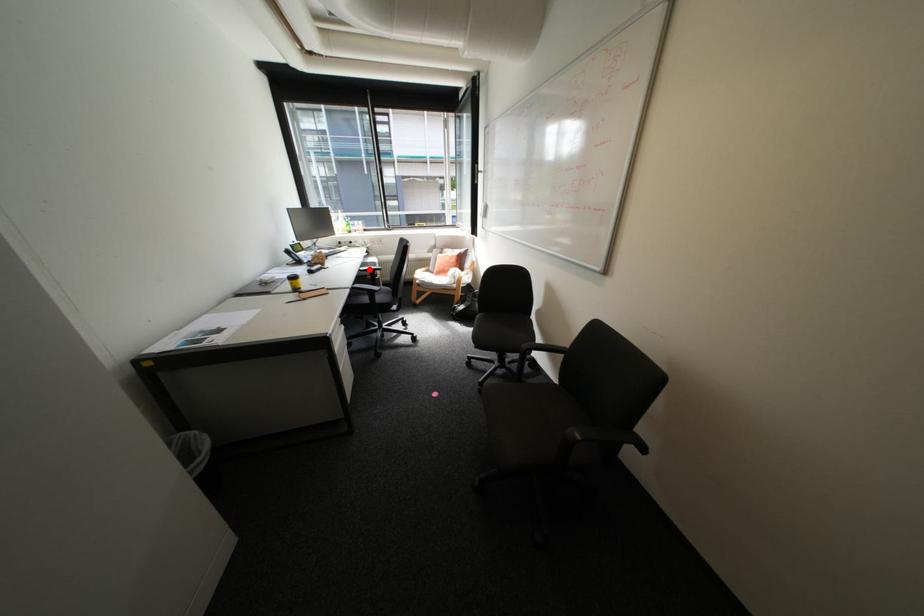
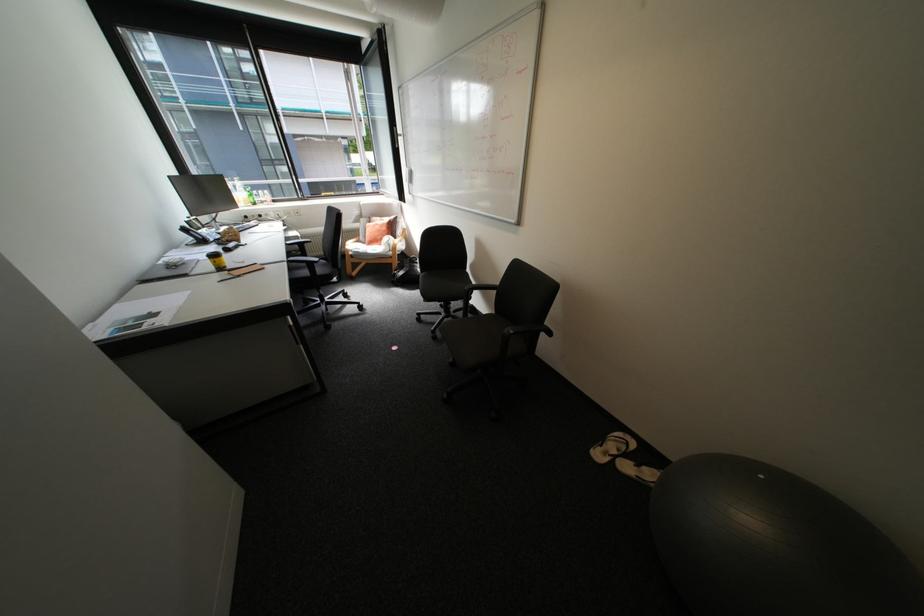
Question: I am providing you with two images of the same scene from different viewpoints. In image1, a red point is highlighted. Considering the same 3D point in image2, which of the following is correct?

Choices:
 (A) It is closer
 (B) It is farther

Answer: (A)